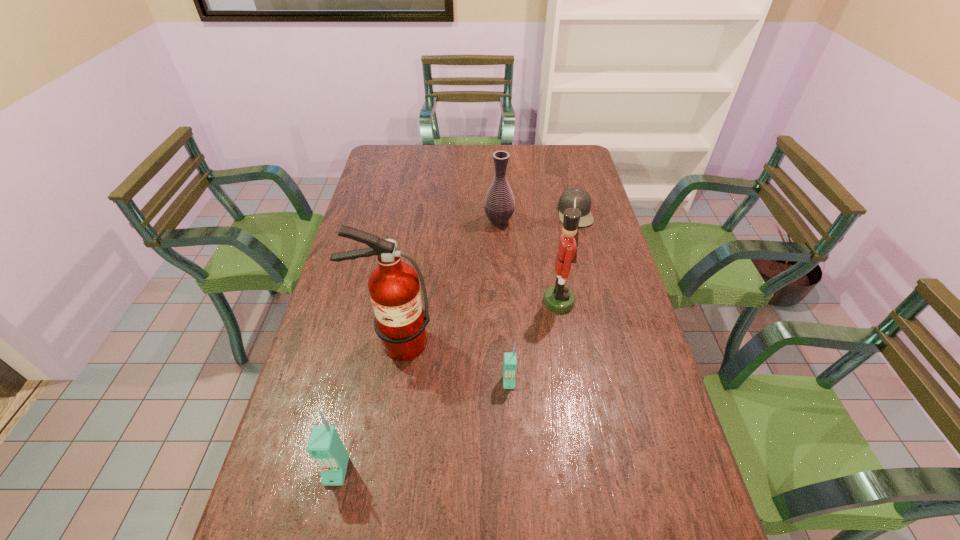
The image size is (960, 540). Identify the location of free space that is in between the fire extinguisher and the taller cellular telephone. (366, 407).

Image resolution: width=960 pixels, height=540 pixels. I want to click on empty space between the second object from right to left and the third shortest object, so click(x=447, y=386).

In order to click on vacant region between the shortest object and the farther cellular telephone in this screenshot , I will do `click(541, 298)`.

Identify the location of free space between the right cellular telephone and the nutcracker. (534, 342).

You are a GUI agent. You are given a task and a screenshot of the screen. Output one action in this format:
    pyautogui.click(x=<x>, y=<y>)
    Task: Click on the object that can be found as the fifth closest to the fire extinguisher
    
    Given the screenshot: What is the action you would take?
    pyautogui.click(x=583, y=200)

Identify the location of object that ranks as the fourth closest to the fourth nearest object. (400, 320).

At what (x,y) coordinates should I click in order to perform the action: click on free space that satisfies the following two spatial constraints: 1. on the front-facing side of the fourth nearest object; 2. on the nozzle and handle of the fire extinguisher. Please return your answer as a coordinate pair (x, y). Image resolution: width=960 pixels, height=540 pixels. Looking at the image, I should click on (565, 343).

In order to click on vacant position in the image that satisfies the following two spatial constraints: 1. on the brim of the cap; 2. on the nozzle and handle of the fire extinguisher in this screenshot , I will do `click(608, 343)`.

Locate an element on the screen. This screenshot has height=540, width=960. free location that satisfies the following two spatial constraints: 1. on the front-facing side of the fourth nearest object; 2. on the keypad of the left cellular telephone is located at coordinates (588, 471).

At what (x,y) coordinates should I click in order to perform the action: click on free space that satisfies the following two spatial constraints: 1. on the brim of the shortest object; 2. on the front side of the vase. Please return your answer as a coordinate pair (x, y). The image size is (960, 540). Looking at the image, I should click on click(577, 221).